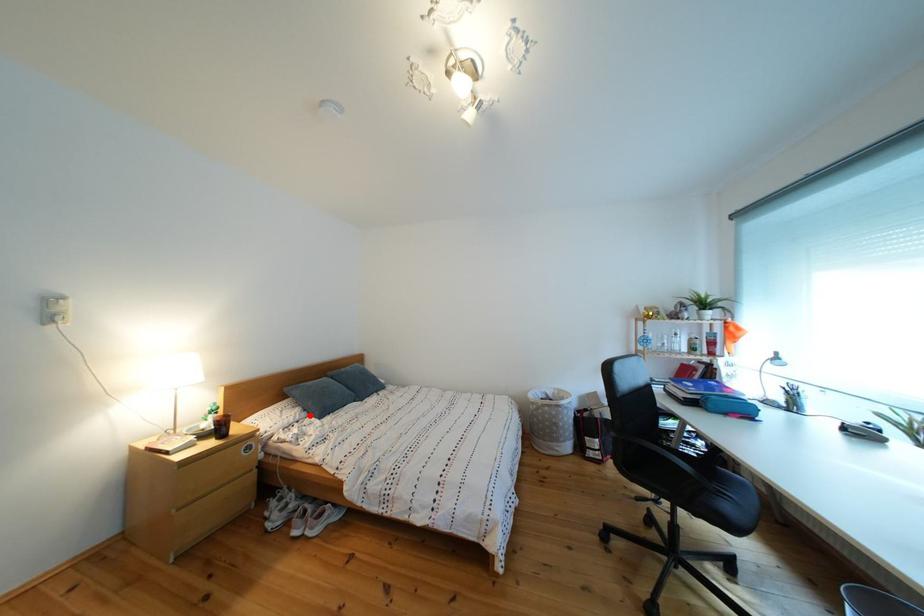
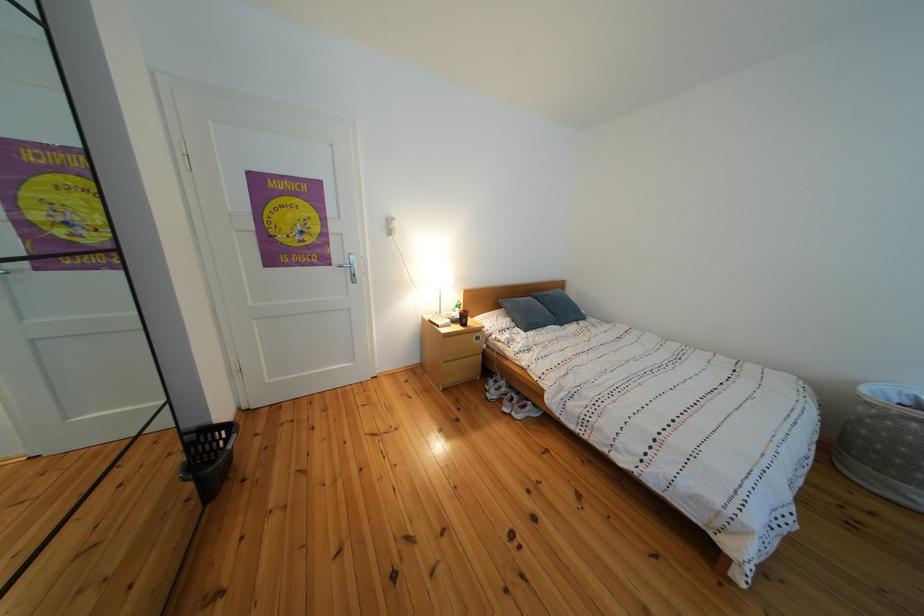
Question: I am providing you with two images of the same scene from different viewpoints. Image1 has a red point marked. In image2, the corresponding 3D location appears at what relative position? Reply with the corresponding letter.

Choices:
 (A) Closer
 (B) Farther

Answer: (A)